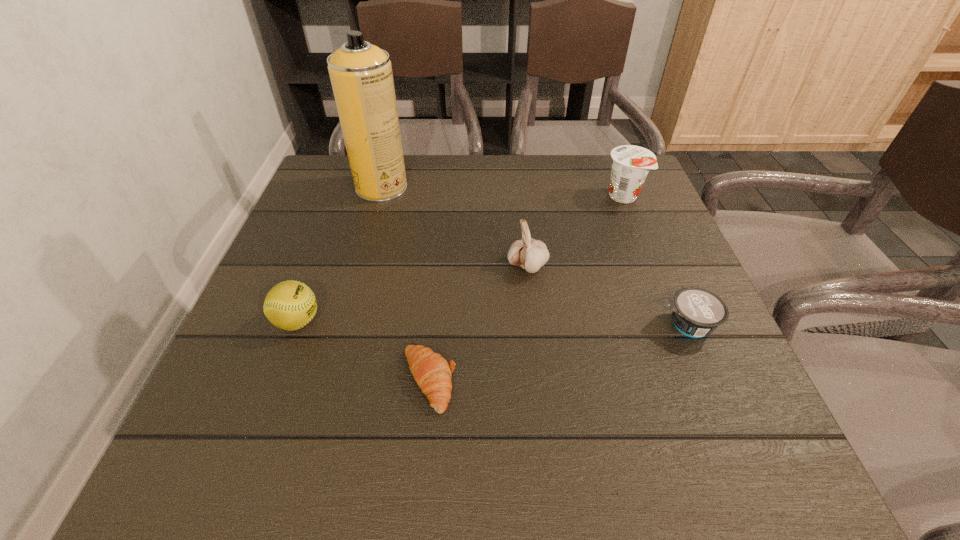
In order to click on vacant space that's between the nearer yogurt and the fourth tallest object in this screenshot , I will do `click(492, 323)`.

Find the location of a particular element. The width and height of the screenshot is (960, 540). free point between the taller yogurt and the fifth tallest object is located at coordinates (655, 261).

Image resolution: width=960 pixels, height=540 pixels. I want to click on empty space that is in between the fifth tallest object and the softball, so click(x=492, y=323).

Identify the location of blank region between the crescent roll and the fourth tallest object. The height and width of the screenshot is (540, 960). (363, 350).

Identify the location of unoccupied area between the taller yogurt and the fifth tallest object. The height and width of the screenshot is (540, 960). (655, 261).

Identify the location of object that stands as the third closest to the nearer yogurt. (432, 373).

You are a GUI agent. You are given a task and a screenshot of the screen. Output one action in this format:
    pyautogui.click(x=<x>, y=<y>)
    Task: Click on the third closest object to the shorter yogurt
    This screenshot has height=540, width=960.
    Given the screenshot: What is the action you would take?
    pyautogui.click(x=432, y=373)

The image size is (960, 540). Identify the location of vacant region that satisfies the following two spatial constraints: 1. on the back side of the taller yogurt; 2. on the right side of the nearest object. (446, 196).

Locate an element on the screen. This screenshot has height=540, width=960. vacant area in the image that satisfies the following two spatial constraints: 1. on the front side of the aerosol can; 2. on the left side of the farther yogurt is located at coordinates (379, 196).

Identify the location of free spot that satisfies the following two spatial constraints: 1. on the front side of the aerosol can; 2. on the right side of the farther yogurt. The width and height of the screenshot is (960, 540). (379, 196).